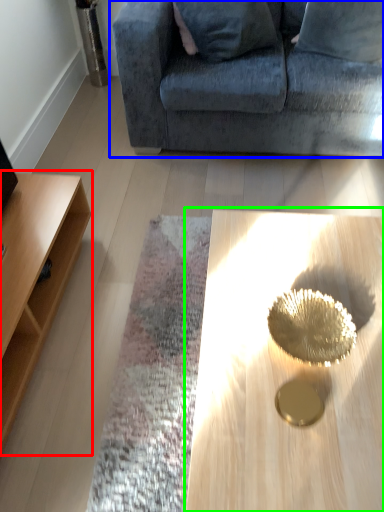
Question: Based on their relative distances, which object is nearer to table (highlighted by a red box)? Choose from studio couch (highlighted by a blue box) and coffee table (highlighted by a green box).

Choices:
 (A) studio couch
 (B) coffee table

Answer: (B)